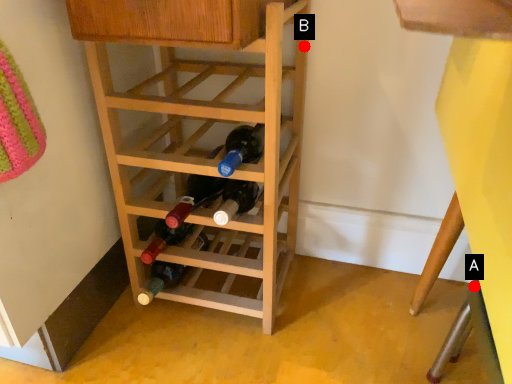
Question: Two points are circled on the image, labeled by A and B beside each circle. Which point appears farthest from the camera in this image?

Choices:
 (A) A is further
 (B) B is further

Answer: (A)